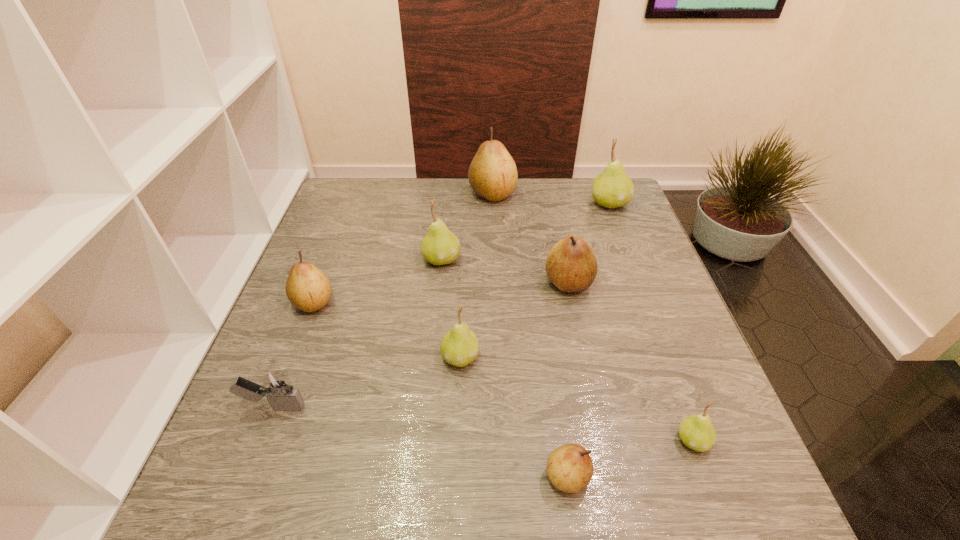
Locate an element on the screen. the nearest brown pear is located at coordinates (570, 468).

Where is `the nearest green pear`? the nearest green pear is located at coordinates (696, 431).

Find the location of a particular element. This screenshot has height=540, width=960. free location located 0.370m on the left of the farthest brown pear is located at coordinates (348, 194).

I want to click on free spot located on the left of the biggest green pear, so click(x=543, y=204).

Locate an element on the screen. Image resolution: width=960 pixels, height=540 pixels. vacant area situated on the right of the third smallest green pear is located at coordinates (488, 259).

The width and height of the screenshot is (960, 540). I want to click on vacant space located 0.110m on the right of the second biggest brown pear, so click(x=637, y=282).

Where is `free location located 0.260m on the back of the second smallest brown pear`? free location located 0.260m on the back of the second smallest brown pear is located at coordinates (344, 224).

Where is `free space located on the front of the fourth nearest object`? The image size is (960, 540). free space located on the front of the fourth nearest object is located at coordinates (457, 434).

The height and width of the screenshot is (540, 960). What are the coordinates of `vacant point located on the back of the gray igniter` in the screenshot? It's located at (302, 332).

The image size is (960, 540). I want to click on free region located on the right of the smallest brown pear, so pyautogui.click(x=674, y=476).